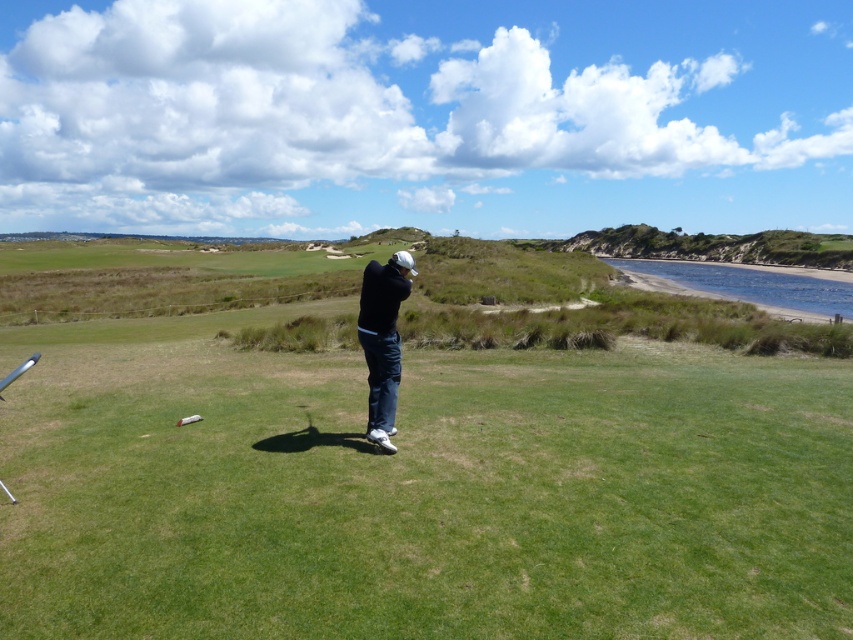
You are a golfer standing on the green grass at center. You want to place your black matte jacket at center on the ground without it being hidden by the grass. Is the grass tall enough to hide the jacket?

The green grass at center is taller than black matte jacket at center, so placing the jacket there would result in the grass hiding the jacket.

You are a photographer standing behind the golfer. You want to capture a photo where both the green grass at center and the black matte jacket at center are clearly visible. However, your camera can only focus on objects at a single distance. Which object should you focus on to ensure both are in focus?

You should focus on the black matte jacket at center because it is farther away from the viewer than the green grass at center. By focusing on the farther object, the depth of field will include the closer green grass at center as well, ensuring both are in focus.